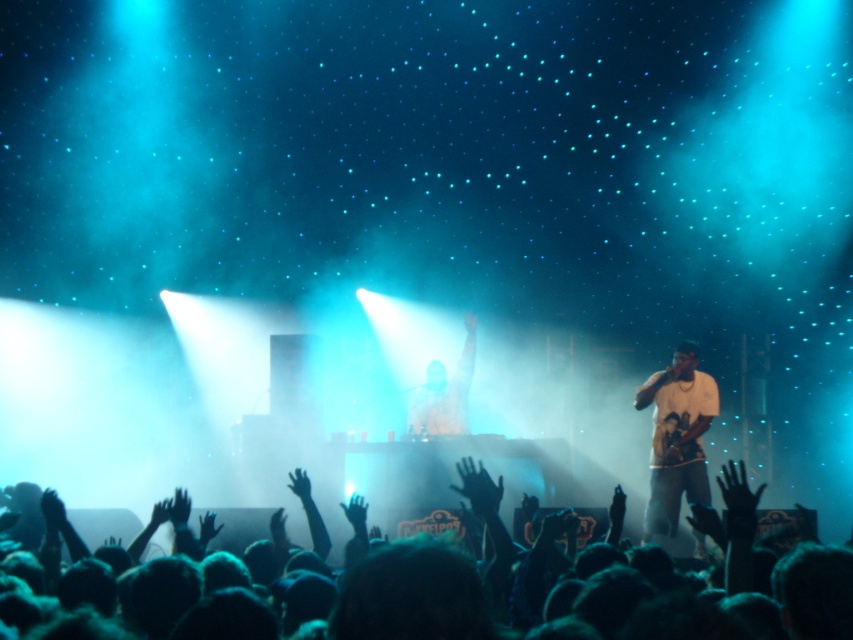
You are a photographer at the concert and want to capture a photo of both the black hair at lower center and the white cotton shirt at center. Since you can only focus on one subject at a time, which one should you focus on to ensure it appears larger in the photo?

The black hair at lower center is not as tall as the white cotton shirt at center, so you should focus on the white cotton shirt at center to make it appear larger in the photo.

You are a photographer standing at the edge of the stage. You want to take a photo that includes both the black hair at lower center and the white cotton shirt at center. Is there enough space between them to fit both in the frame without cropping either?

The black hair at lower center and white cotton shirt at center are 8.33 feet apart, so yes, there is enough space between them to fit both in the frame without cropping either.

You are a photographer at the concert. You want to take a photo of the black hair at lower center and white cotton shirt at center. Which object should you focus on first if you want to capture both in the same frame?

The black hair at lower center is to the left of white cotton shirt at center, so you should focus on the black hair at lower center first to ensure both are in the frame.